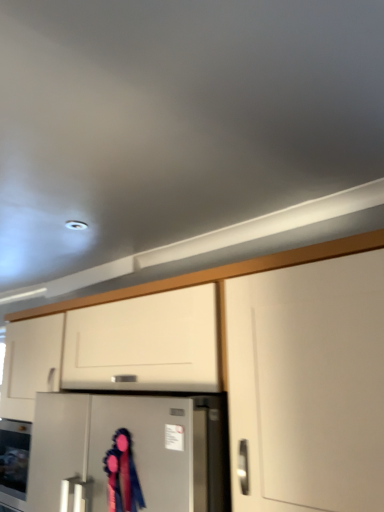
This screenshot has height=512, width=384. Describe the element at coordinates (122, 475) in the screenshot. I see `velvet ribbon at center` at that location.

What is the approximate width of satin silver refrigerator at center?

It is 29.44 inches.

Describe the element at coordinates (219, 283) in the screenshot. The height and width of the screenshot is (512, 384). I see `white matte cabinet at center` at that location.

Identify the location of velvet ribbon at center. The width and height of the screenshot is (384, 512). (122, 475).

Is white matte cabinet at center inside or outside of velvet ribbon at center?

white matte cabinet at center is located beyond the bounds of velvet ribbon at center.

Would you consider white matte cabinet at center to be distant from velvet ribbon at center?

That's not correct — white matte cabinet at center is a little close to velvet ribbon at center.

Which object is further away from the camera taking this photo, white matte cabinet at center or velvet ribbon at center?

velvet ribbon at center is behind.

Is white matte cabinet at center positioned with its back to velvet ribbon at center?

Absolutely, white matte cabinet at center is directed away from velvet ribbon at center.

Is velvet ribbon at center facing towards white matte cabinet at center?

No, velvet ribbon at center is not facing towards white matte cabinet at center.

Who is shorter, velvet ribbon at center or white matte cabinet at center?

velvet ribbon at center.

Is velvet ribbon at center with white matte cabinet at center?

No, velvet ribbon at center is not making contact with white matte cabinet at center.

Does velvet ribbon at center have a smaller size compared to white matte cabinet at center?

Yes.

Is white matte cabinet at center far away from satin silver refrigerator at center?

No, there isn't a large distance between white matte cabinet at center and satin silver refrigerator at center.

Can you confirm if white matte cabinet at center is thinner than satin silver refrigerator at center?

Yes, white matte cabinet at center is thinner than satin silver refrigerator at center.

Could you tell me if white matte cabinet at center is facing satin silver refrigerator at center?

Yes, white matte cabinet at center faces towards satin silver refrigerator at center.

Looking at this image, from a real-world perspective, between white matte cabinet at center and satin silver refrigerator at center, who is vertically higher?

In real-world perspective, white matte cabinet at center is above.

Find the location of a particular element. The image size is (384, 512). refrigerator that is on the right side of velvet ribbon at center is located at coordinates (129, 453).

Which is behind, velvet ribbon at center or satin silver refrigerator at center?

velvet ribbon at center is further away from the camera.

Which object is positioned more to the right, satin silver refrigerator at center or white matte cabinet at center?

white matte cabinet at center is more to the right.

Which is behind, point (175, 447) or point (113, 291)?

The point (113, 291) is more distant.

Does satin silver refrigerator at center turn towards white matte cabinet at center?

Yes, satin silver refrigerator at center is turned towards white matte cabinet at center.

From a real-world perspective, which object rests below the other?

In real-world perspective, satin silver refrigerator at center is lower.

Is velvet ribbon at center at the back of satin silver refrigerator at center?

satin silver refrigerator at center does not have its back to velvet ribbon at center.

Based on the photo, would you consider satin silver refrigerator at center to be distant from velvet ribbon at center?

No, satin silver refrigerator at center is not far away from velvet ribbon at center.

In the scene shown: Considering the relative positions of satin silver refrigerator at center and velvet ribbon at center in the image provided, is satin silver refrigerator at center to the left or to the right of velvet ribbon at center?

satin silver refrigerator at center is positioned on velvet ribbon at center's right side.

At what (x,y) coordinates should I click in order to perform the action: click on cabinetry lying in front of the velvet ribbon at center. Please return your answer as a coordinate pair (x, y). The image size is (384, 512). Looking at the image, I should click on (219, 283).

Image resolution: width=384 pixels, height=512 pixels. In order to click on woman on the left of white matte cabinet at center in this screenshot , I will do `click(122, 475)`.

Based on their spatial positions, is white matte cabinet at center or satin silver refrigerator at center closer to velvet ribbon at center?

satin silver refrigerator at center.

Consider the image. From the image, which object appears to be farther from satin silver refrigerator at center, white matte cabinet at center or velvet ribbon at center?

white matte cabinet at center is positioned further to the anchor satin silver refrigerator at center.

From the image, which object appears to be nearer to velvet ribbon at center, satin silver refrigerator at center or white matte cabinet at center?

satin silver refrigerator at center is closer to velvet ribbon at center.

From the image, which object appears to be nearer to white matte cabinet at center, satin silver refrigerator at center or velvet ribbon at center?

satin silver refrigerator at center.

Which object lies nearer to the anchor point white matte cabinet at center, velvet ribbon at center or satin silver refrigerator at center?

satin silver refrigerator at center lies closer to white matte cabinet at center than the other object.

From the image, which object appears to be nearer to satin silver refrigerator at center, velvet ribbon at center or white matte cabinet at center?

Among the two, velvet ribbon at center is located nearer to satin silver refrigerator at center.

Where is `refrigerator positioned between white matte cabinet at center and velvet ribbon at center from near to far`? The image size is (384, 512). refrigerator positioned between white matte cabinet at center and velvet ribbon at center from near to far is located at coordinates click(x=129, y=453).